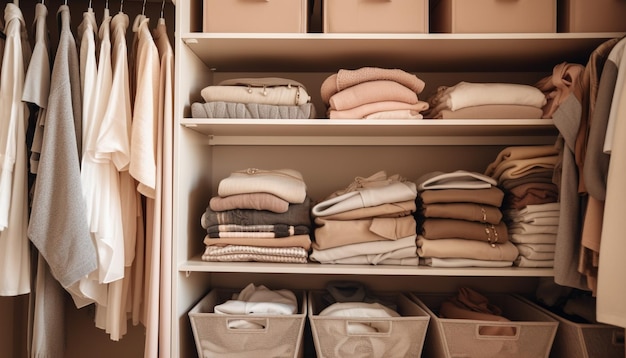
Identify the location of baskets on shelves. This screenshot has height=358, width=626. (272, 10), (379, 12), (524, 12), (588, 17), (255, 341), (345, 339), (485, 349), (595, 337).